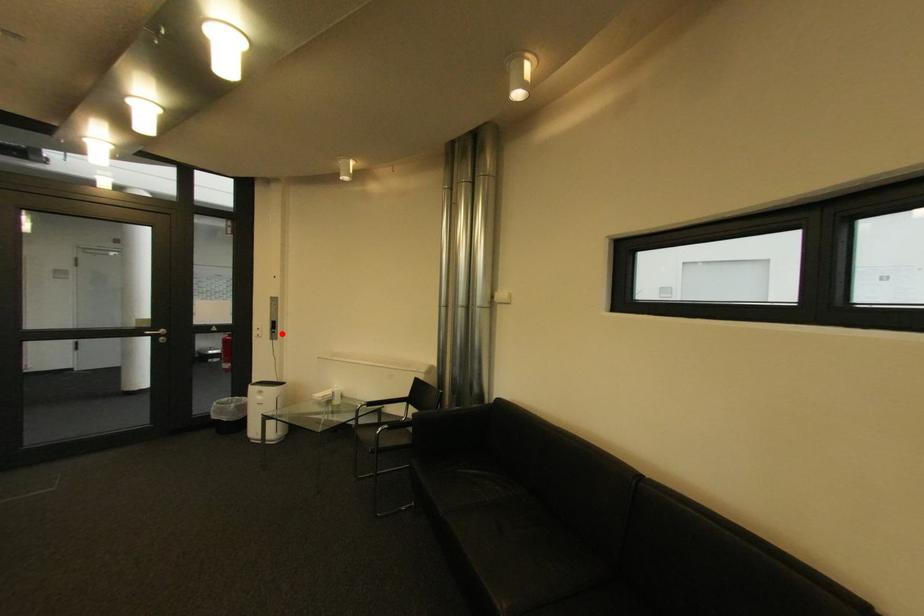
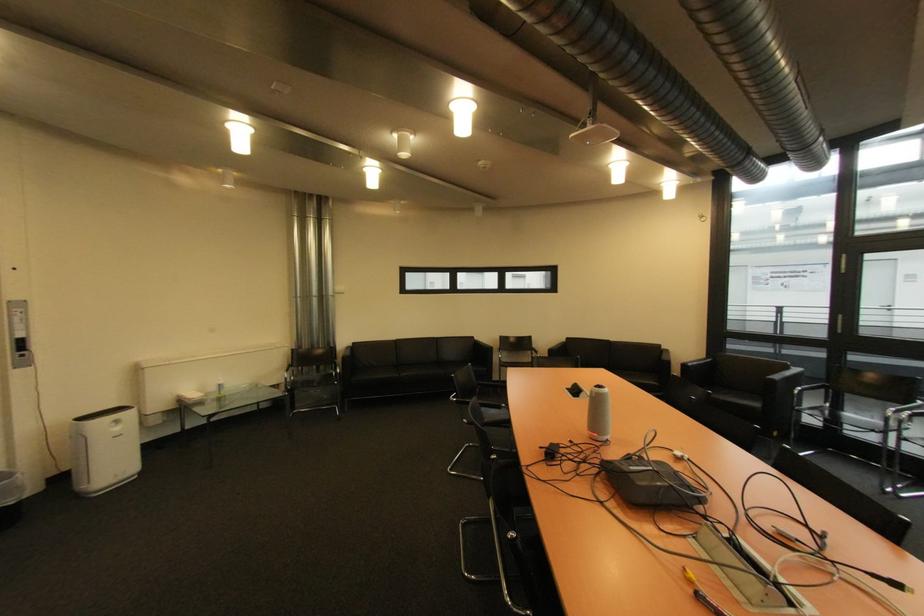
Where in the second image is the point corresponding to the highlighted location from the first image?

(30, 357)